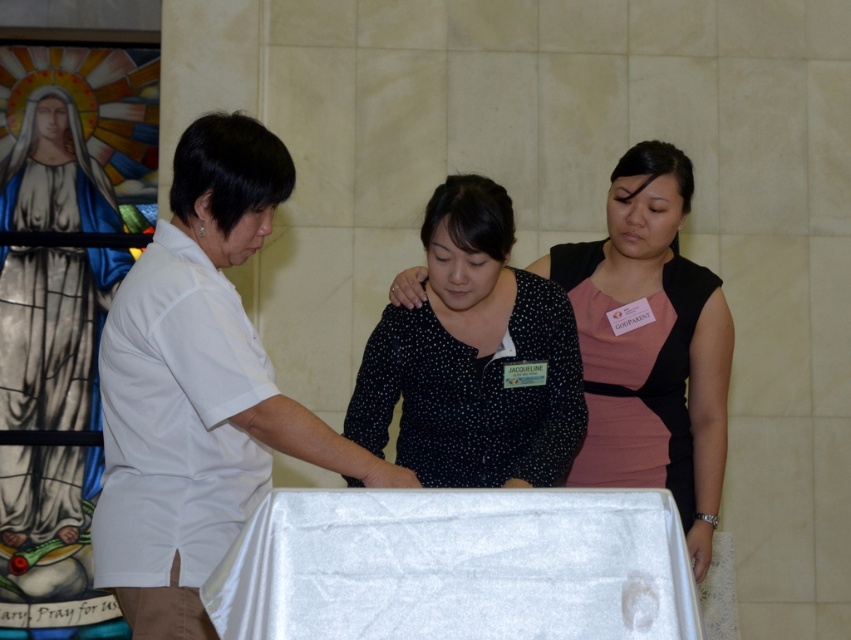
Between white matte shirt at center and black dotted dress at center, which one is positioned higher?

Positioned higher is white matte shirt at center.

Between white matte shirt at center and black dotted dress at center, which one appears on the right side from the viewer's perspective?

Positioned to the right is black dotted dress at center.

In order to click on white matte shirt at center in this screenshot , I will do `click(198, 388)`.

Is white matte shirt at center thinner than white satin table at center?

Answer: Indeed, white matte shirt at center has a lesser width compared to white satin table at center.

Who is more distant from viewer, (147, 260) or (523, 605)?

The point (147, 260) is behind.

Find the location of a particular element. white matte shirt at center is located at coordinates (198, 388).

Can you confirm if black dotted blouse at center is positioned to the left of black dotted dress at center?

Yes, black dotted blouse at center is to the left of black dotted dress at center.

Who is more forward, (x=410, y=323) or (x=614, y=401)?

Point (x=410, y=323) is in front.

Identify the location of black dotted blouse at center. (473, 356).